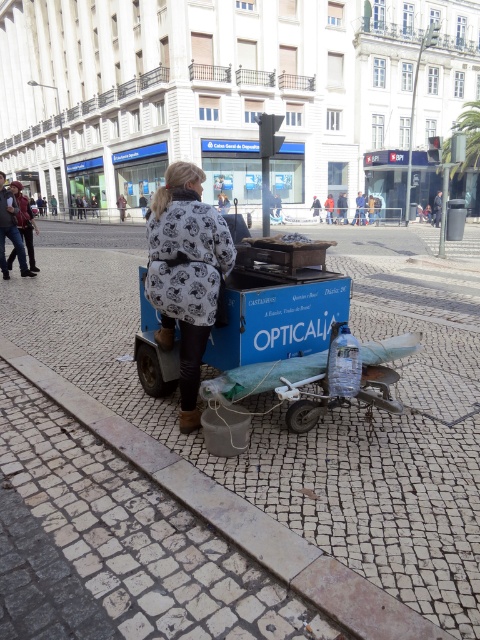
You are standing on the street and see two points marked in the scene. Which point is closer to you? The points are labeled as point [165,429] and point [156,214].

Point [156,214] is closer to you because it is in front of point [165,429].